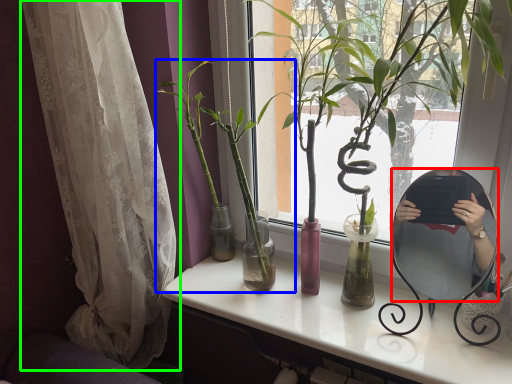
Question: Which is farther away from mirror (highlighted by a red box)? houseplant (highlighted by a blue box) or curtain (highlighted by a green box)?

Choices:
 (A) houseplant
 (B) curtain

Answer: (B)